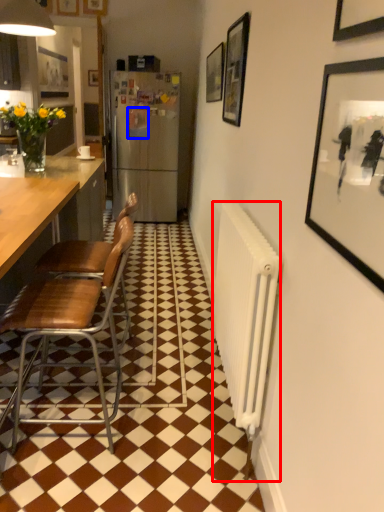
Question: Which object is closer to the camera taking this photo, radiator (highlighted by a red box) or picture frame (highlighted by a blue box)?

Choices:
 (A) radiator
 (B) picture frame

Answer: (A)